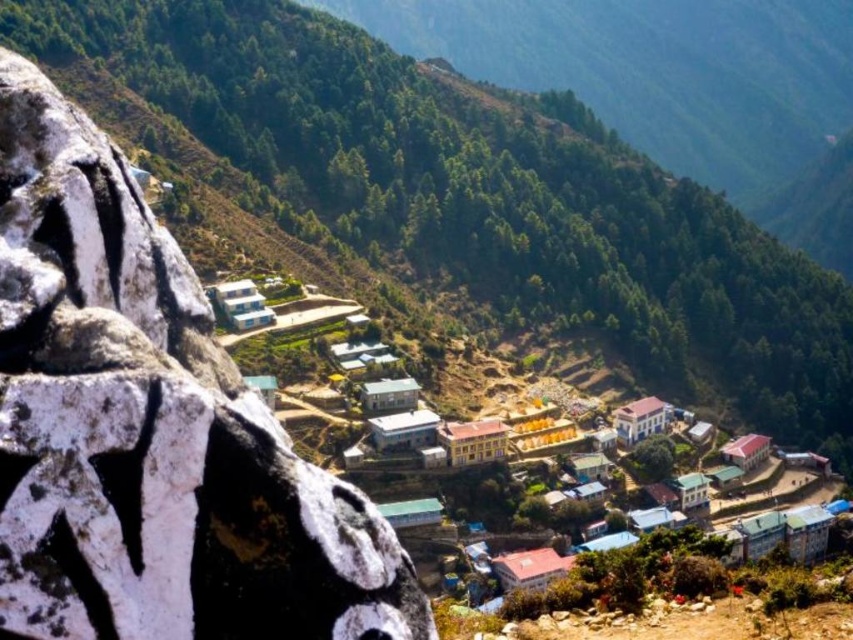
You are a hiker standing at the point marked by the coordinate point (x=149, y=429) in the image. What type of terrain are you currently standing on?

The point (x=149, y=429) indicates white textured rock at left, so you are standing on white textured rock.

You are a hiker planning to climb the rugged rock face in the foreground of the mountain village scene. You notice two rocks labeled as the green matte rock at left and the white textured rock at left. Which rock should you avoid stepping on if you want to minimize the risk of slipping?

The white textured rock at left has a rougher surface compared to the green matte rock at left, making it less slippery. Therefore, you should avoid stepping on the green matte rock at left to minimize slipping risk.